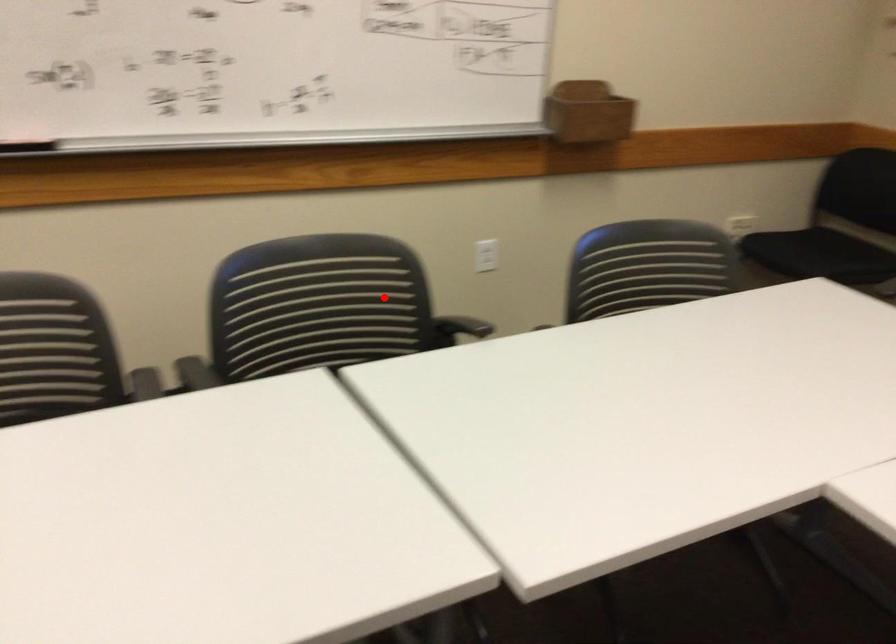
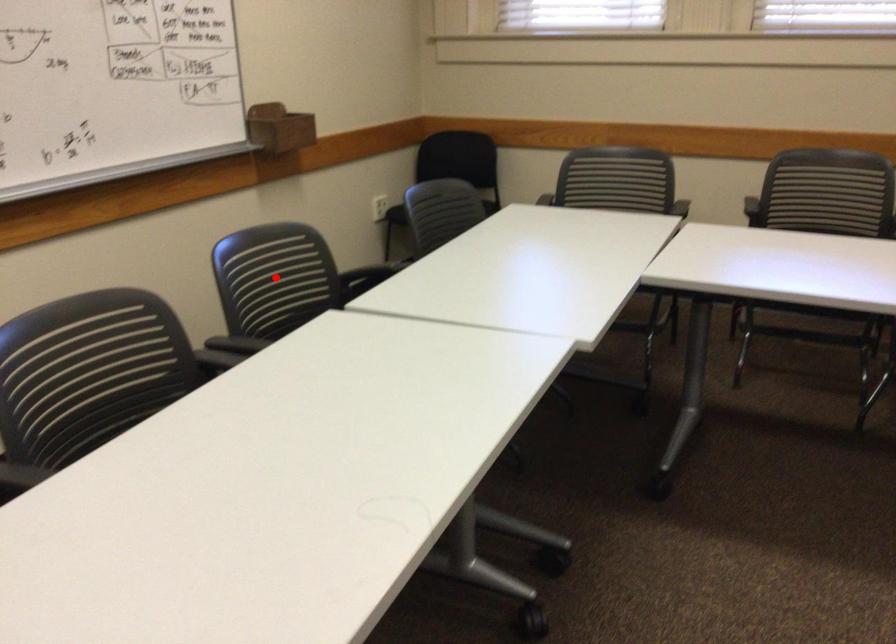
I am providing you with two images of the same scene from different viewpoints. A red point is marked on the first image and another point is marked on the second image. Is the red point in image1 aligned with the point shown in image2?

Yes